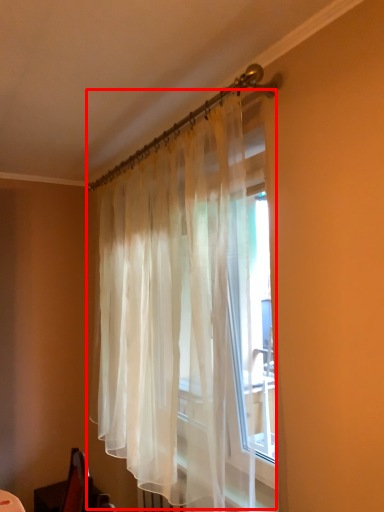
Question: From the image's perspective, where is curtain (annotated by the red box) located relative to swivel chair?

Choices:
 (A) below
 (B) above

Answer: (B)